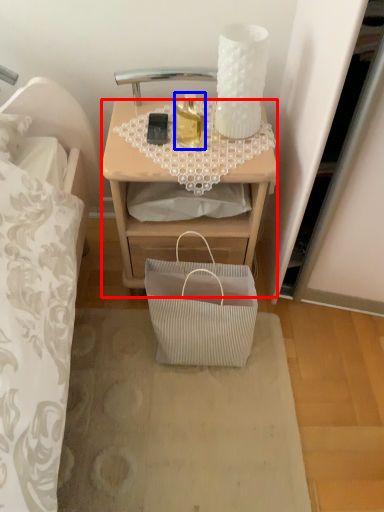
Question: Which object appears closest to the camera in this image, desk (highlighted by a red box) or bottle (highlighted by a blue box)?

Choices:
 (A) desk
 (B) bottle

Answer: (B)